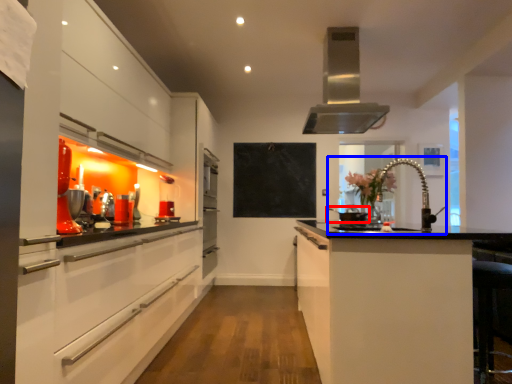
Question: Among these objects, which one is farthest to the camera, appliance (highlighted by a red box) or sink (highlighted by a blue box)?

Choices:
 (A) appliance
 (B) sink

Answer: (A)